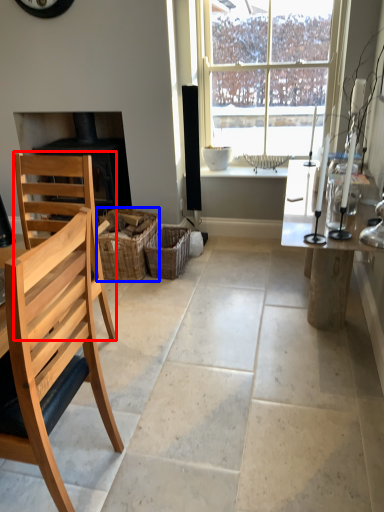
Question: Which of the following is the farthest to the observer, chair (highlighted by a red box) or crate (highlighted by a blue box)?

Choices:
 (A) chair
 (B) crate

Answer: (B)